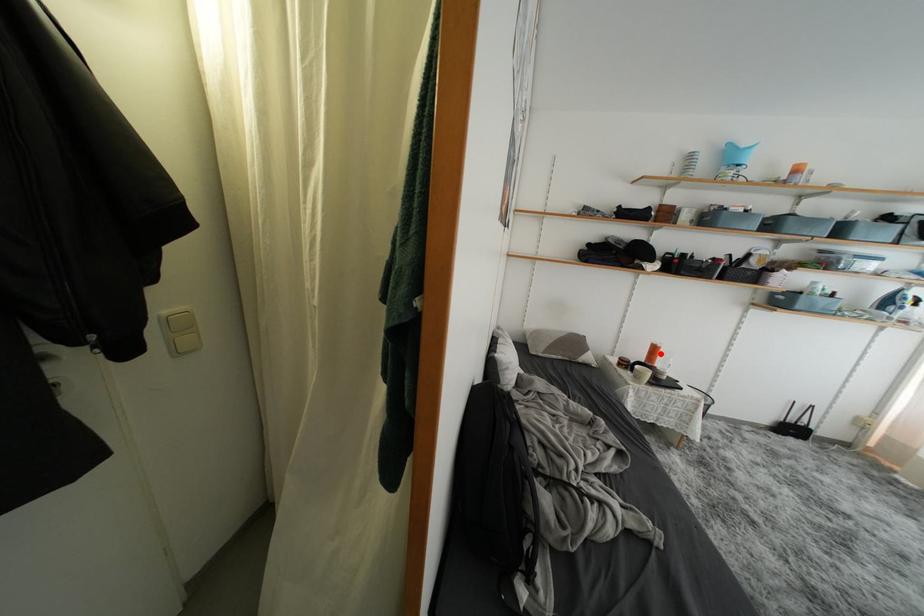
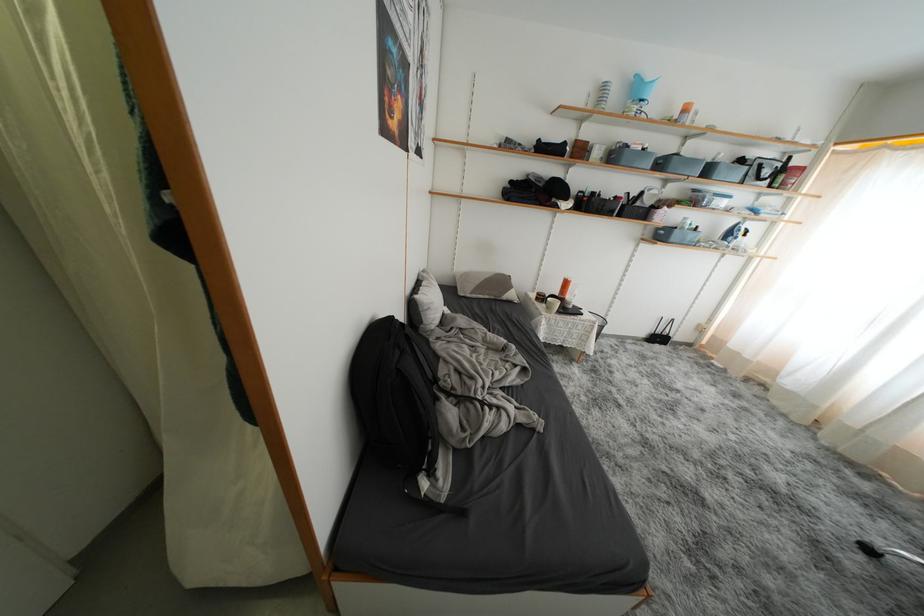
Find the pixel in the second image that matches the highlighted location in the first image.

(572, 286)